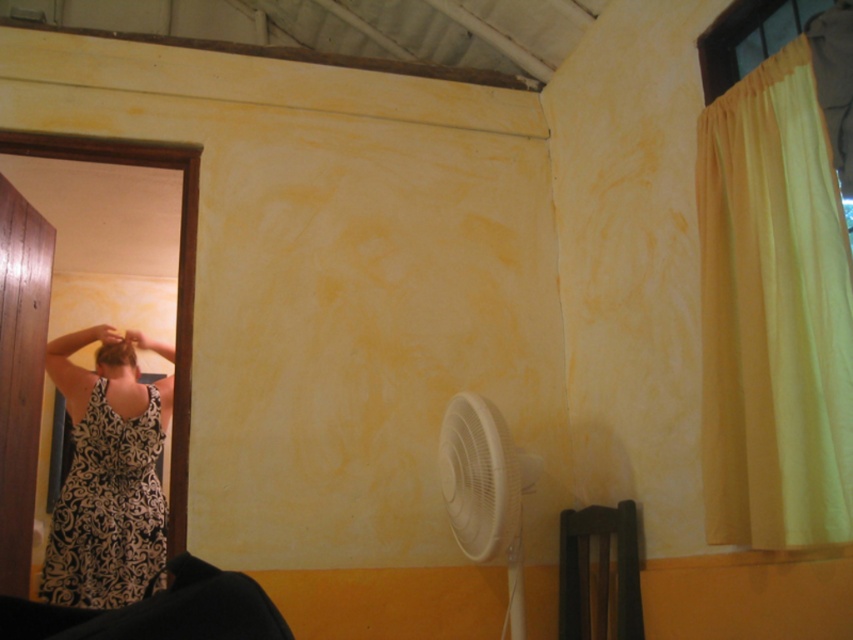
Does white plastic fan at lower center appear on the left side of brown curly hair at upper left?

In fact, white plastic fan at lower center is to the right of brown curly hair at upper left.

Between white plastic fan at lower center and brown curly hair at upper left, which one has less height?

brown curly hair at upper left is shorter.

Does point (488, 516) come closer to viewer compared to point (113, 339)?

Yes, it is in front of point (113, 339).

Image resolution: width=853 pixels, height=640 pixels. What are the coordinates of `white plastic fan at lower center` in the screenshot? It's located at (485, 492).

Is black printed fabric dress at lower left wider than white plastic fan at lower center?

Correct, the width of black printed fabric dress at lower left exceeds that of white plastic fan at lower center.

Is the position of black printed fabric dress at lower left more distant than that of white plastic fan at lower center?

Yes, black printed fabric dress at lower left is behind white plastic fan at lower center.

What do you see at coordinates (108, 509) in the screenshot? The width and height of the screenshot is (853, 640). I see `black printed fabric dress at lower left` at bounding box center [108, 509].

At what (x,y) coordinates should I click in order to perform the action: click on black printed fabric dress at lower left. Please return your answer as a coordinate pair (x, y). Looking at the image, I should click on (108, 509).

Can you confirm if yellow fabric curtain at right is positioned below brown curly hair at upper left?

Actually, yellow fabric curtain at right is above brown curly hair at upper left.

Which is below, yellow fabric curtain at right or brown curly hair at upper left?

Positioned lower is brown curly hair at upper left.

Between point (759, 422) and point (106, 352), which one is positioned in front?

Point (759, 422)

You are a GUI agent. You are given a task and a screenshot of the screen. Output one action in this format:
    pyautogui.click(x=<x>, y=<y>)
    Task: Click on the yellow fabric curtain at right
    
    Given the screenshot: What is the action you would take?
    pyautogui.click(x=773, y=314)